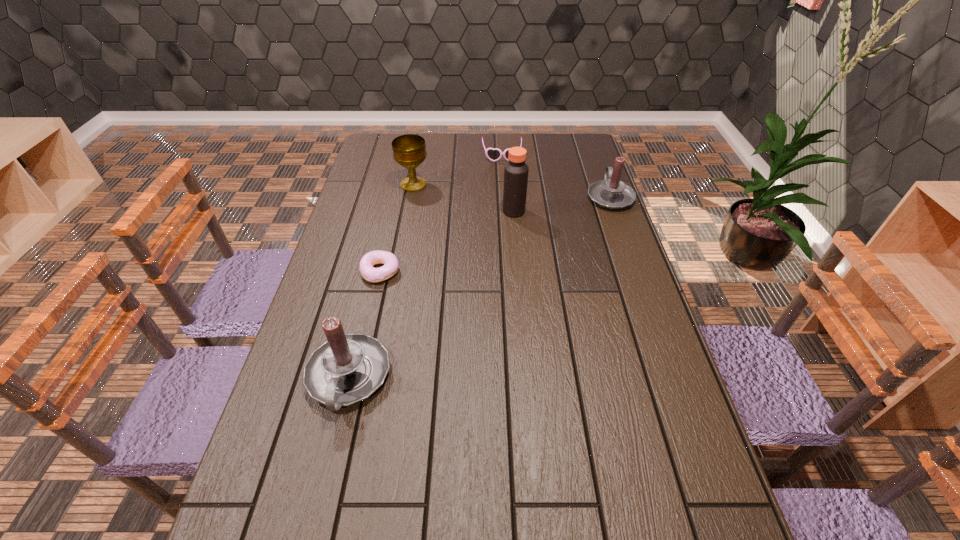
Find the location of `chalice that is at the left edge`. chalice that is at the left edge is located at coordinates (409, 150).

The width and height of the screenshot is (960, 540). Identify the location of doughnut that is at the left edge. (390, 268).

This screenshot has width=960, height=540. Identify the location of object located in the right edge section of the desktop. (611, 193).

In the image, there is a desktop. Where is `free space at the far edge`? The height and width of the screenshot is (540, 960). free space at the far edge is located at coordinates (471, 147).

The image size is (960, 540). Identify the location of vacant area at the near edge. [x=521, y=483].

In the image, there is a desktop. Where is `vacant space at the left edge`? The width and height of the screenshot is (960, 540). vacant space at the left edge is located at coordinates (368, 237).

I want to click on vacant area at the right edge of the desktop, so click(x=622, y=261).

In the image, there is a desktop. At what (x,y) coordinates should I click in order to perform the action: click on vacant space at the far left corner. Please return your answer as a coordinate pair (x, y). Looking at the image, I should click on (383, 137).

You are a GUI agent. You are given a task and a screenshot of the screen. Output one action in this format:
    pyautogui.click(x=<x>, y=<y>)
    Task: Click on the vacant space at the near left corner of the desktop
    The width and height of the screenshot is (960, 540).
    Given the screenshot: What is the action you would take?
    pyautogui.click(x=311, y=474)

Locate an element on the screen. Image resolution: width=960 pixels, height=540 pixels. free space at the far right corner of the desktop is located at coordinates (577, 144).